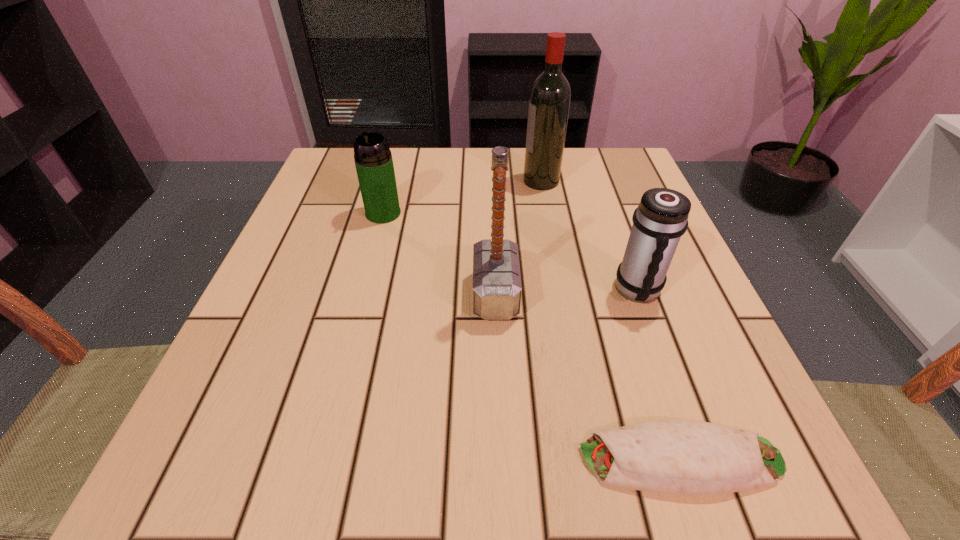
Locate an element on the screen. free space located on the striking surface of the fourth object from right to left is located at coordinates (420, 294).

Locate an element on the screen. vacant space located on the striking surface of the fourth object from right to left is located at coordinates (344, 294).

Where is `free point located 0.100m on the striking surface of the fourth object from right to left`? free point located 0.100m on the striking surface of the fourth object from right to left is located at coordinates (415, 294).

The height and width of the screenshot is (540, 960). In order to click on vacant space located from the spout of the leftmost object in this screenshot , I will do `click(374, 246)`.

This screenshot has width=960, height=540. In order to click on free space located 0.190m on the side with the handle of the nearer thermos bottle in this screenshot , I will do `click(684, 418)`.

Find the location of a particular element. vacant space situated at the bitten end of the nearest object is located at coordinates (273, 460).

Locate an element on the screen. This screenshot has width=960, height=540. free space located at the bitten end of the nearest object is located at coordinates (459, 460).

Where is `free space located 0.080m at the bitten end of the nearest object`? free space located 0.080m at the bitten end of the nearest object is located at coordinates (516, 460).

The width and height of the screenshot is (960, 540). Identify the location of wine bottle situated at the far edge. (549, 103).

This screenshot has width=960, height=540. I want to click on thermos bottle positioned at the far edge, so click(373, 159).